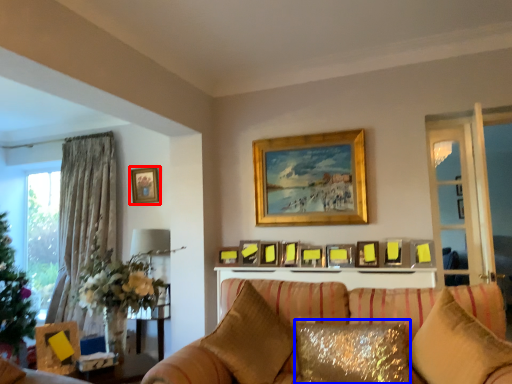
Question: Which point is closer to the camera, picture frame (highlighted by a red box) or pillow (highlighted by a blue box)?

Choices:
 (A) picture frame
 (B) pillow

Answer: (B)